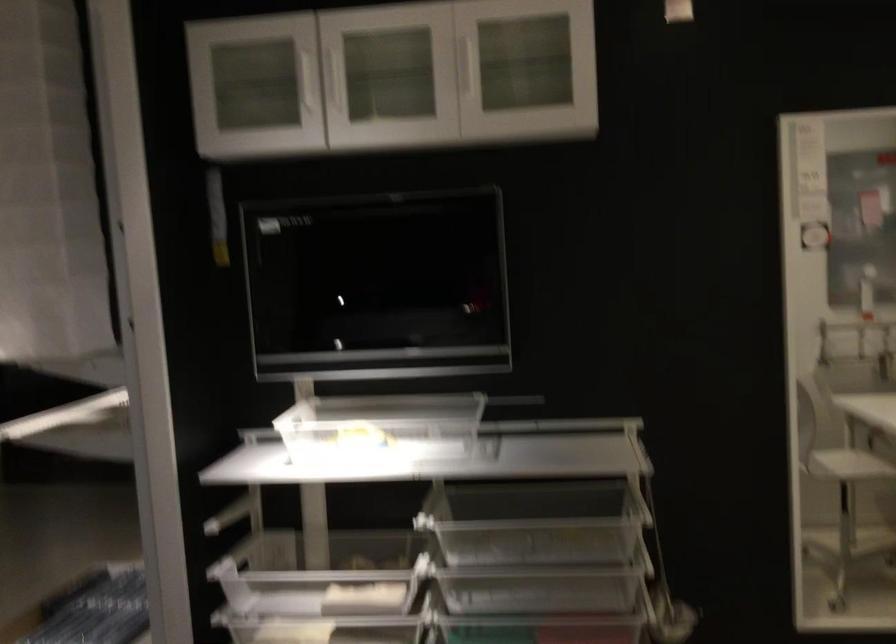
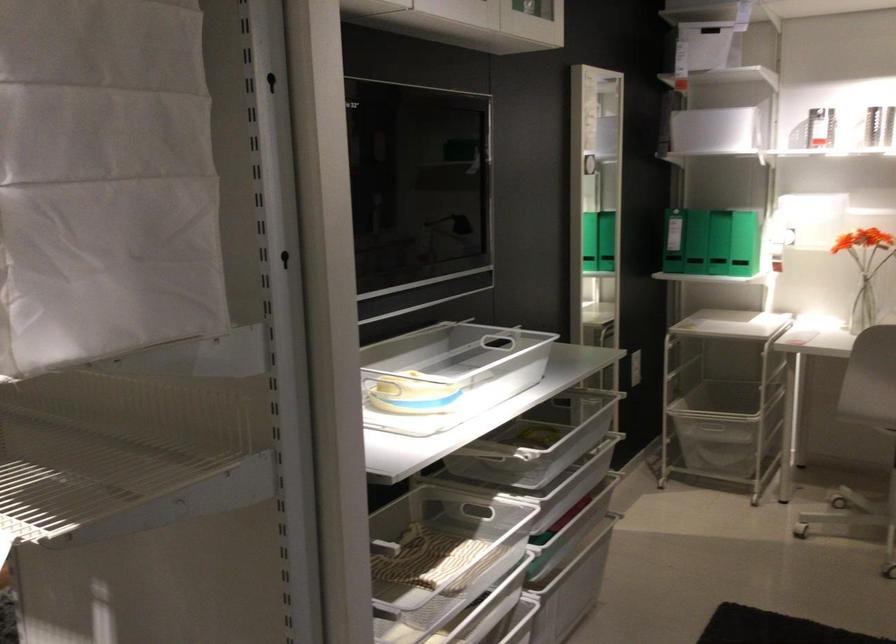
Locate, in the second image, the point that corresponds to (109,447) in the first image.

(108, 444)